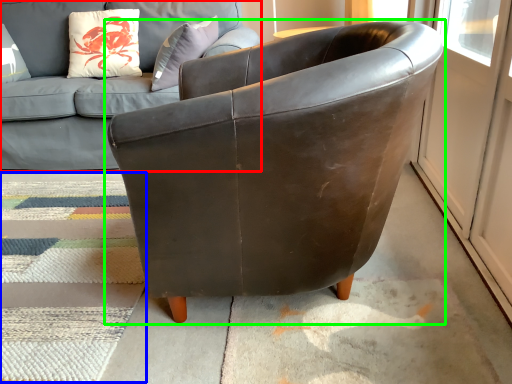
Question: Considering the real-world distances, which object is farthest from studio couch (highlighted by a red box)? mat (highlighted by a blue box) or chair (highlighted by a green box)?

Choices:
 (A) mat
 (B) chair

Answer: (B)